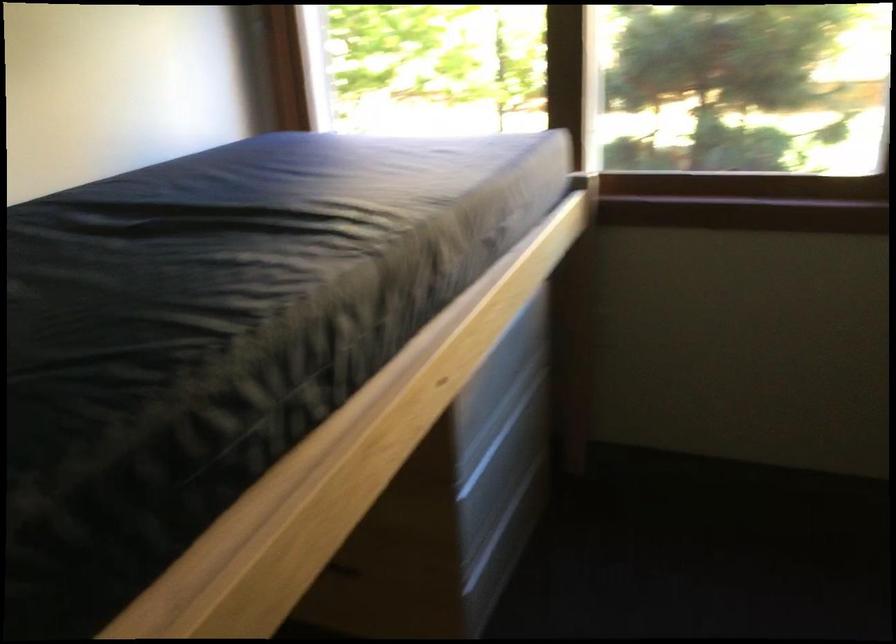
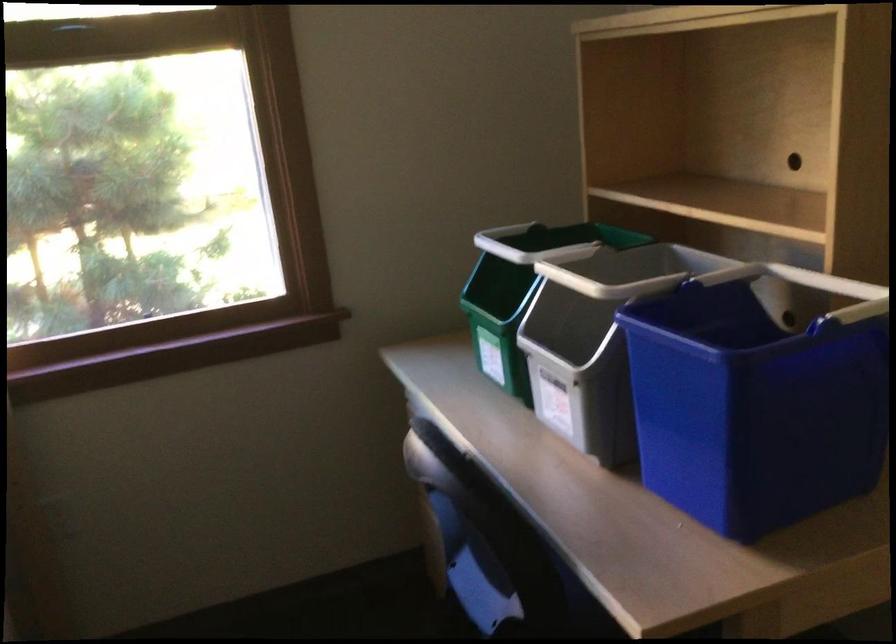
Question: Based on the continuous images, in which direction is the camera rotating? Reply with the corresponding letter.

Choices:
 (A) Left
 (B) Right
 (C) Up
 (D) Down

Answer: (B)